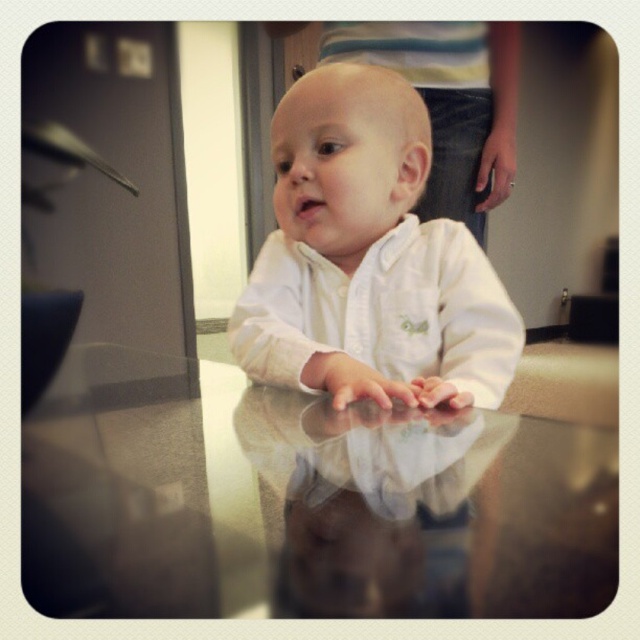
Between white matte shirt at center and white glossy hands at center, which one has more height?

With more height is white matte shirt at center.

Consider the image. Who is more forward, (355, 291) or (440, 476)?

Point (440, 476) is more forward.

Locate an element on the screen. white matte shirt at center is located at coordinates (368, 257).

Find the location of a particular element. This screenshot has height=640, width=640. white matte shirt at center is located at coordinates (368, 257).

Locate an element on the screen. white matte shirt at center is located at coordinates (368, 257).

Between white glossy hands at center and white matte hand at center, which one has more height?

With more height is white matte hand at center.

Which is behind, point (433, 464) or point (339, 387)?

Positioned behind is point (339, 387).

Where is `white glossy hands at center`? white glossy hands at center is located at coordinates (372, 502).